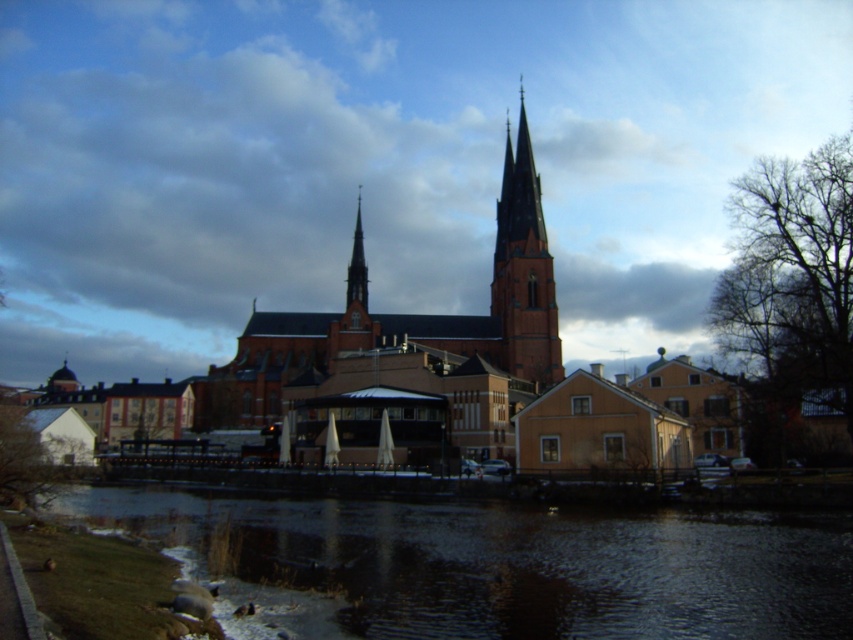
Who is positioned more to the left, red brick church at center or brick steeple at center?

Positioned to the left is red brick church at center.

Who is shorter, red brick church at center or brick steeple at center?

Standing shorter between the two is brick steeple at center.

Locate an element on the screen. red brick church at center is located at coordinates (416, 342).

The width and height of the screenshot is (853, 640). In order to click on red brick church at center in this screenshot , I will do `click(416, 342)`.

Which is behind, point (515, 154) or point (357, 294)?

The point (515, 154) is more distant.

Does point (515, 196) come behind point (357, 272)?

Yes, point (515, 196) is farther from viewer.

The width and height of the screenshot is (853, 640). I want to click on brick steeple at center, so coord(524,268).

In the scene shown: Can you confirm if green grass at lower left is bigger than smooth red brick spire at center?

Yes.

At what (x,y) coordinates should I click in order to perform the action: click on green grass at lower left. Please return your answer as a coordinate pair (x, y). The height and width of the screenshot is (640, 853). Looking at the image, I should click on (509, 563).